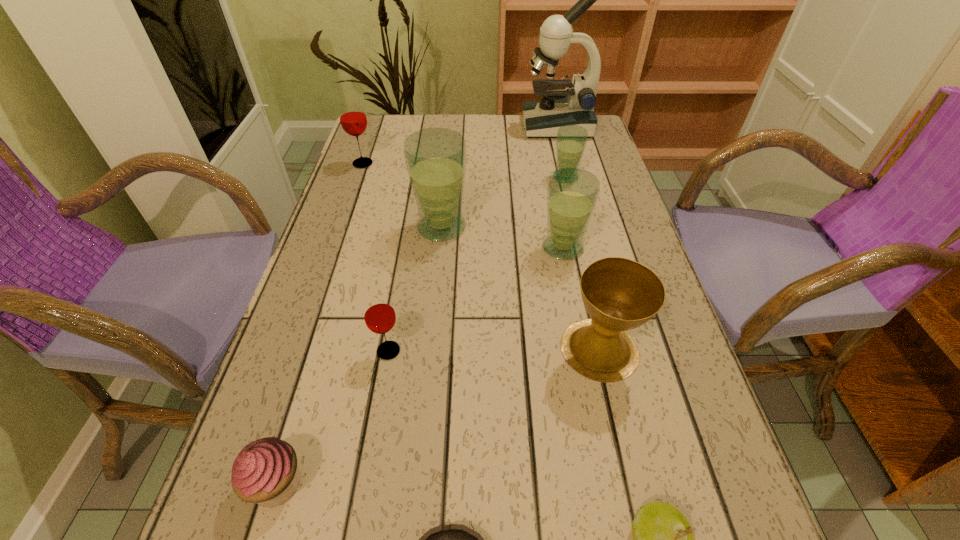
Where is `vacant space positioned 0.270m on the right of the smaller red glass`? Image resolution: width=960 pixels, height=540 pixels. vacant space positioned 0.270m on the right of the smaller red glass is located at coordinates (549, 351).

Find the location of a particular element. vacant space located on the back of the pink cupcake is located at coordinates (319, 347).

Identify the location of object that is positioned at the far edge. This screenshot has width=960, height=540. (543, 118).

Locate an element on the screen. This screenshot has width=960, height=540. glass situated at the left edge is located at coordinates (353, 119).

Find the location of a particular element. Image resolution: width=960 pixels, height=540 pixels. cupcake present at the left edge is located at coordinates (266, 472).

Locate an element on the screen. The width and height of the screenshot is (960, 540). microscope at the right edge is located at coordinates [543, 118].

You are a GUI agent. You are given a task and a screenshot of the screen. Output one action in this format:
    pyautogui.click(x=<x>, y=<y>)
    Task: Click on the chalice at the right edge
    
    Given the screenshot: What is the action you would take?
    pyautogui.click(x=619, y=294)

In order to click on object located at the far right corner in this screenshot , I will do `click(543, 118)`.

The height and width of the screenshot is (540, 960). I want to click on vacant space at the far edge of the desktop, so click(x=501, y=141).

Locate an element on the screen. vacant space at the left edge is located at coordinates (352, 286).